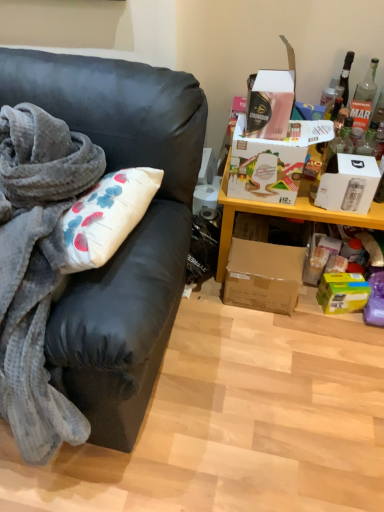
Question: From the image's perspective, would you say white cardboard box at right, placed as the 2th box when sorted from top to bottom, is shown under matte black couch at left?

Choices:
 (A) yes
 (B) no

Answer: (B)

Question: Can you confirm if white cardboard box at right, placed as the 2th box when sorted from top to bottom, is bigger than matte black couch at left?

Choices:
 (A) no
 (B) yes

Answer: (A)

Question: From a real-world perspective, does white cardboard box at right, the 3th box in the bottom-to-top sequence, sit lower than matte black couch at left?

Choices:
 (A) yes
 (B) no

Answer: (B)

Question: Can you confirm if white cardboard box at right, placed as the 2th box when sorted from top to bottom, is wider than matte black couch at left?

Choices:
 (A) no
 (B) yes

Answer: (A)

Question: Is white cardboard box at right, the 3th box in the bottom-to-top sequence, aimed at matte black couch at left?

Choices:
 (A) no
 (B) yes

Answer: (A)

Question: Is white cardboard box at right, the 3th box in the bottom-to-top sequence, positioned before matte black couch at left?

Choices:
 (A) yes
 (B) no

Answer: (B)

Question: Is brown cardboard box at lower right, acting as the second box starting from the bottom, positioned beyond the bounds of white cardboard box at upper right, which is counted as the first box, starting from the top?

Choices:
 (A) no
 (B) yes

Answer: (B)

Question: From a real-world perspective, is brown cardboard box at lower right, acting as the second box starting from the bottom, on top of white cardboard box at upper right, which is counted as the first box, starting from the top?

Choices:
 (A) yes
 (B) no

Answer: (B)

Question: Does brown cardboard box at lower right, acting as the second box starting from the bottom, appear on the right side of white cardboard box at upper right, which is counted as the first box, starting from the top?

Choices:
 (A) no
 (B) yes

Answer: (B)

Question: Is white cardboard box at upper right, which is counted as the first box, starting from the top, surrounded by brown cardboard box at lower right, the third box when ordered from top to bottom?

Choices:
 (A) yes
 (B) no

Answer: (B)

Question: Can you confirm if brown cardboard box at lower right, the third box when ordered from top to bottom, is taller than white cardboard box at upper right, which is counted as the first box, starting from the top?

Choices:
 (A) no
 (B) yes

Answer: (B)

Question: From a real-world perspective, is brown cardboard box at lower right, the third box when ordered from top to bottom, positioned under white cardboard box at upper right, which is counted as the first box, starting from the top, based on gravity?

Choices:
 (A) yes
 (B) no

Answer: (A)

Question: Considering the relative sizes of white cardboard box at upper right, which is counted as the first box, starting from the top, and green matte box at lower right, which ranks as the 1th box in bottom-to-top order, in the image provided, is white cardboard box at upper right, which is counted as the first box, starting from the top, shorter than green matte box at lower right, which ranks as the 1th box in bottom-to-top order,?

Choices:
 (A) no
 (B) yes

Answer: (A)